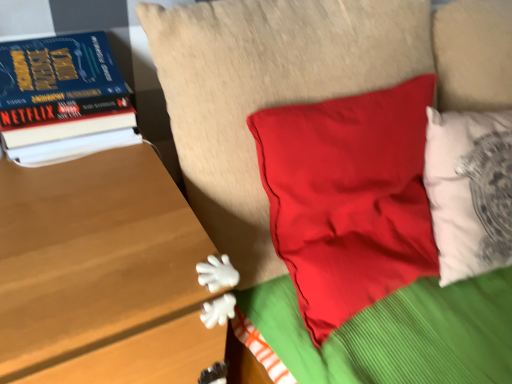
Question: From the image's perspective, is wooden table at left positioned above or below matte red pillow at center?

Choices:
 (A) above
 (B) below

Answer: (B)

Question: From their relative heights in the image, would you say wooden table at left is taller or shorter than matte red pillow at center?

Choices:
 (A) tall
 (B) short

Answer: (A)

Question: Which is nearer to the matte red pillow at center?

Choices:
 (A) wooden table at left
 (B) hardcover book at left

Answer: (B)

Question: Which is nearer to the wooden table at left?

Choices:
 (A) matte red pillow at center
 (B) hardcover book at left

Answer: (B)